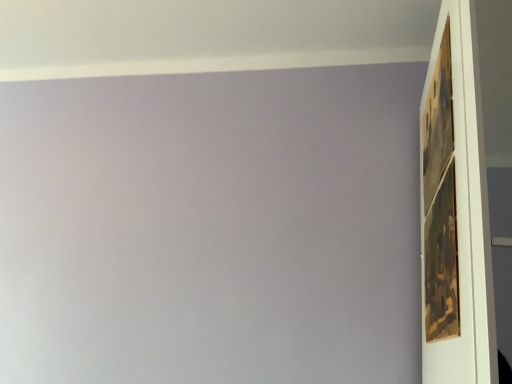
Question: Should I look upward or downward to see wooden picture frame at upper right?

Choices:
 (A) down
 (B) up

Answer: (A)